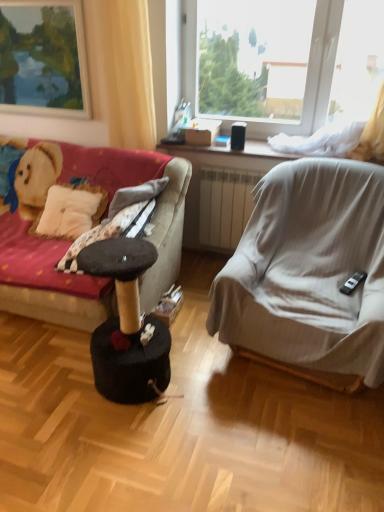
Question: Considering the positions of matte wooden picture frame at upper left and black felt cat tree at center in the image, is matte wooden picture frame at upper left bigger or smaller than black felt cat tree at center?

Choices:
 (A) big
 (B) small

Answer: (B)

Question: Considering their positions, is matte wooden picture frame at upper left located in front of or behind black felt cat tree at center?

Choices:
 (A) front
 (B) behind

Answer: (B)

Question: Which of these objects is positioned closest to the transparent plastic window at upper center?

Choices:
 (A) velvet fabric couch at left
 (B) black felt cat tree at center
 (C) light gray fabric chair at right
 (D) matte wooden picture frame at upper left
 (E) yellow fabric curtain at upper left

Answer: (E)

Question: Estimate the real-world distances between objects in this image. Which object is farther from the light gray fabric chair at right?

Choices:
 (A) black felt cat tree at center
 (B) matte wooden picture frame at upper left
 (C) velvet fabric couch at left
 (D) transparent plastic window at upper center
 (E) yellow fabric curtain at upper left

Answer: (B)